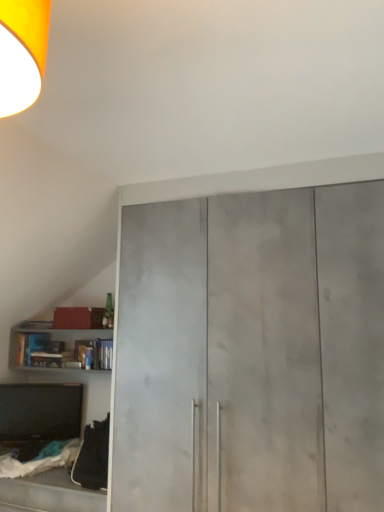
The width and height of the screenshot is (384, 512). What do you see at coordinates (230, 192) in the screenshot? I see `matte concrete cupboard at center` at bounding box center [230, 192].

You are a GUI agent. You are given a task and a screenshot of the screen. Output one action in this format:
    pyautogui.click(x=<x>, y=<y>)
    Task: Click on the matte concrete cupboard at center
    Image resolution: width=384 pixels, height=512 pixels.
    Given the screenshot: What is the action you would take?
    pyautogui.click(x=230, y=192)

Image resolution: width=384 pixels, height=512 pixels. Describe the element at coordinates (48, 345) in the screenshot. I see `matte gray bookshelf at lower left` at that location.

The image size is (384, 512). I want to click on matte gray bookshelf at lower left, so click(x=48, y=345).

What are the coordinates of `matte concrete cupboard at center` in the screenshot? It's located at (230, 192).

Is matte concrete cupboard at center to the left of matte gray bookshelf at lower left from the viewer's perspective?

In fact, matte concrete cupboard at center is to the right of matte gray bookshelf at lower left.

Is the position of matte concrete cupboard at center more distant than that of matte gray bookshelf at lower left?

That is False.

Which is in front, point (355, 175) or point (21, 341)?

The point (355, 175) is closer to the camera.

From the image's perspective, is matte concrete cupboard at center positioned above or below matte gray bookshelf at lower left?

matte concrete cupboard at center is situated higher than matte gray bookshelf at lower left in the image.

From a real-world perspective, does matte concrete cupboard at center stand above matte gray bookshelf at lower left?

No, from a real-world perspective, matte concrete cupboard at center is not on top of matte gray bookshelf at lower left.

Which of these two, matte concrete cupboard at center or matte gray bookshelf at lower left, is thinner?

With smaller width is matte gray bookshelf at lower left.

Looking at this image, considering the relative sizes of matte concrete cupboard at center and matte gray bookshelf at lower left in the image provided, is matte concrete cupboard at center taller than matte gray bookshelf at lower left?

Yes, matte concrete cupboard at center is taller than matte gray bookshelf at lower left.

Who is bigger, matte concrete cupboard at center or matte gray bookshelf at lower left?

With larger size is matte concrete cupboard at center.

Does matte concrete cupboard at center contain matte gray bookshelf at lower left?

No.

Based on the photo, is matte concrete cupboard at center with matte gray bookshelf at lower left?

No, matte concrete cupboard at center is not with matte gray bookshelf at lower left.

Is matte concrete cupboard at center turned away from matte gray bookshelf at lower left?

No, matte concrete cupboard at center's orientation is not away from matte gray bookshelf at lower left.

Find the location of a particular element. This screenshot has height=512, width=384. cabinetry on the left of matte concrete cupboard at center is located at coordinates (48, 345).

Is matte gray bookshelf at lower left at the right side of matte concrete cupboard at center?

No.

Which object is further away from the camera taking this photo, matte gray bookshelf at lower left or matte concrete cupboard at center?

matte gray bookshelf at lower left is behind.

Which is behind, point (19, 345) or point (278, 184)?

The point (19, 345) is farther from the camera.

From the image's perspective, which one is positioned higher, matte gray bookshelf at lower left or matte concrete cupboard at center?

From the image's view, matte concrete cupboard at center is above.

From a real-world perspective, relative to matte concrete cupboard at center, is matte gray bookshelf at lower left vertically above or below?

In terms of real-world spatial position, matte gray bookshelf at lower left is above matte concrete cupboard at center.

Considering the relative sizes of matte gray bookshelf at lower left and matte concrete cupboard at center in the image provided, is matte gray bookshelf at lower left wider than matte concrete cupboard at center?

Incorrect, the width of matte gray bookshelf at lower left does not surpass that of matte concrete cupboard at center.

Who is shorter, matte gray bookshelf at lower left or matte concrete cupboard at center?

matte gray bookshelf at lower left is shorter.

In the scene shown: Considering the relative sizes of matte gray bookshelf at lower left and matte concrete cupboard at center in the image provided, is matte gray bookshelf at lower left smaller than matte concrete cupboard at center?

Yes, matte gray bookshelf at lower left is smaller than matte concrete cupboard at center.

Consider the image. Is matte gray bookshelf at lower left completely or partially outside of matte concrete cupboard at center?

That's correct, matte gray bookshelf at lower left is outside of matte concrete cupboard at center.

In the scene shown: Is matte gray bookshelf at lower left not near matte concrete cupboard at center?

Absolutely, matte gray bookshelf at lower left is distant from matte concrete cupboard at center.

Based on the photo, is matte gray bookshelf at lower left looking in the opposite direction of matte concrete cupboard at center?

No, matte gray bookshelf at lower left's orientation is not away from matte concrete cupboard at center.

Measure the distance from matte gray bookshelf at lower left to matte concrete cupboard at center.

1.09 meters.

What are the coordinates of `cabinetry on the left of the matte concrete cupboard at center` in the screenshot? It's located at (x=48, y=345).

You are a GUI agent. You are given a task and a screenshot of the screen. Output one action in this format:
    pyautogui.click(x=<x>, y=<y>)
    Task: Click on the cabinetry above the matte concrete cupboard at center (from a real-world perspective)
    This screenshot has height=512, width=384.
    Given the screenshot: What is the action you would take?
    pyautogui.click(x=48, y=345)

In order to click on cupboard on the right of matte gray bookshelf at lower left in this screenshot , I will do `click(230, 192)`.